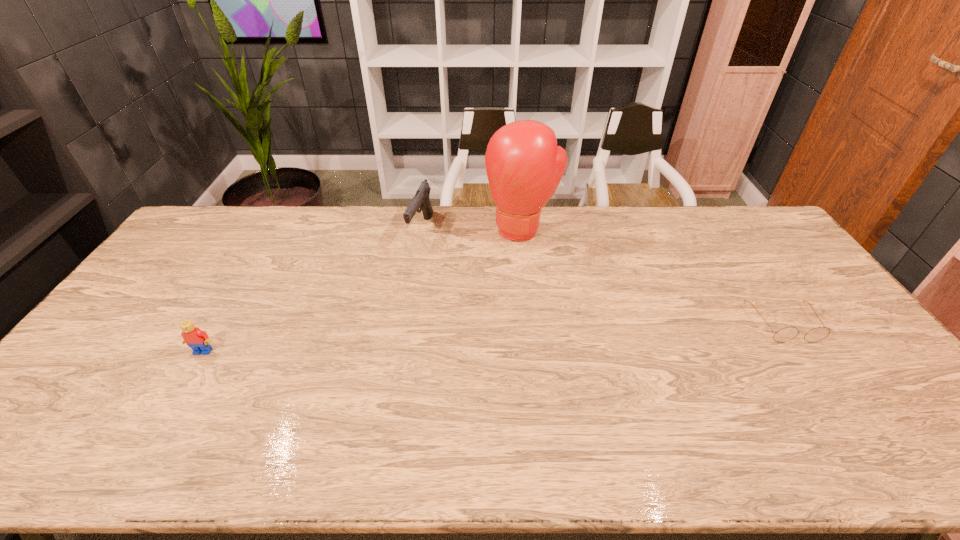
Where is `vacant region located on the striking surface of the second object from right to left`? This screenshot has height=540, width=960. vacant region located on the striking surface of the second object from right to left is located at coordinates tap(510, 260).

Identify the location of vacant position located 0.130m on the striking surface of the second object from right to left. The image size is (960, 540). (505, 273).

Locate an element on the screen. The width and height of the screenshot is (960, 540). free spot located on the striking surface of the second object from right to left is located at coordinates (500, 287).

Locate an element on the screen. The height and width of the screenshot is (540, 960). vacant space situated 0.090m at the muzzle of the third object from right to left is located at coordinates (431, 264).

I want to click on blank space located at the muzzle of the third object from right to left, so click(442, 283).

Where is `free space located 0.090m at the muzzle of the third object from right to left`? The image size is (960, 540). free space located 0.090m at the muzzle of the third object from right to left is located at coordinates pos(431,264).

The width and height of the screenshot is (960, 540). What are the coordinates of `boxing glove that is at the far edge` in the screenshot? It's located at (524, 166).

In order to click on gun situated at the far edge in this screenshot , I will do `click(421, 200)`.

You are a GUI agent. You are given a task and a screenshot of the screen. Output one action in this format:
    pyautogui.click(x=<x>, y=<y>)
    Task: Click on the object situated at the right edge
    Image resolution: width=960 pixels, height=540 pixels.
    Given the screenshot: What is the action you would take?
    pyautogui.click(x=786, y=334)

Identify the location of free space at the far edge. (691, 206).